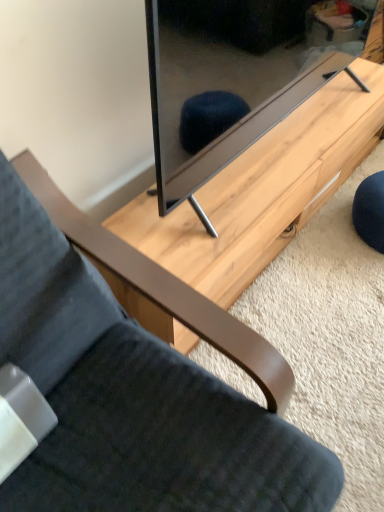
Find the location of a particular element. Image resolution: width=384 pixels, height=512 pixels. vacant region under matte black tv at center (from a real-world perspective) is located at coordinates (283, 138).